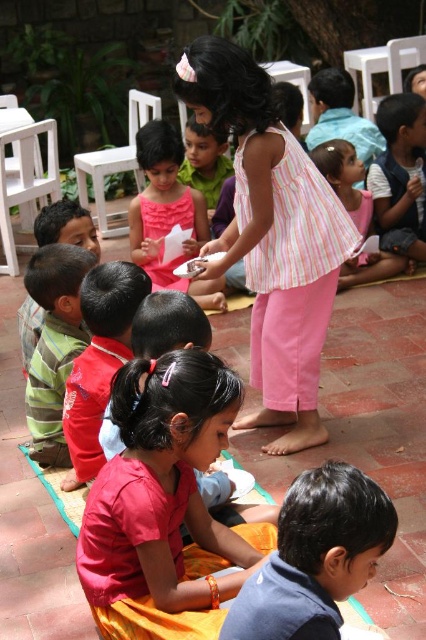
Is matte green shirt at left above pink striped shirt at center?

Actually, matte green shirt at left is below pink striped shirt at center.

Is point (37, 442) positioned before point (337, 289)?

Yes, it is.

Identify the location of matte green shirt at left. click(54, 344).

Between blue cotton shirt at lower right and pink fabric dress at center, which one appears on the right side from the viewer's perspective?

blue cotton shirt at lower right

Looking at this image, is blue cotton shirt at lower right bigger than pink fabric dress at center?

No, blue cotton shirt at lower right is not bigger than pink fabric dress at center.

Is point (236, 627) behind point (192, 291)?

No, (236, 627) is in front of (192, 291).

The height and width of the screenshot is (640, 426). In order to click on blue cotton shirt at lower right in this screenshot , I will do `click(316, 556)`.

Measure the distance between point (x=131, y=228) and camera.

Point (x=131, y=228) is 5.49 meters from camera.

In order to click on pink fabric dress at center in this screenshot , I will do `click(169, 216)`.

Which is behind, point (195, 284) or point (363, 202)?

The point (363, 202) is behind.

You are a GUI agent. You are given a task and a screenshot of the screen. Output one action in this format:
    pyautogui.click(x=<x>, y=<y>)
    Task: Click on the pink fabric dress at center
    Image resolution: width=426 pixels, height=640 pixels.
    Given the screenshot: What is the action you would take?
    pyautogui.click(x=169, y=216)